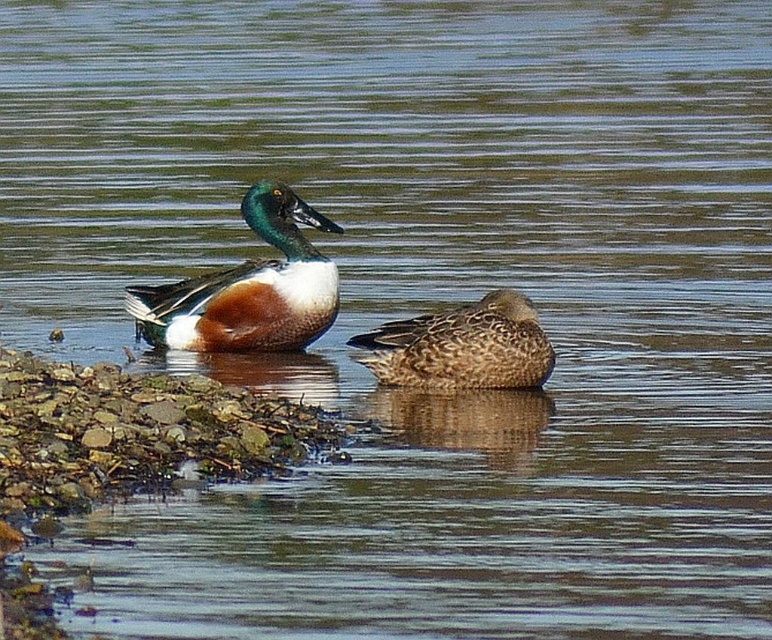
Can you confirm if shiny green duck at center is positioned above brown speckled duck at center?

Indeed, shiny green duck at center is positioned over brown speckled duck at center.

The image size is (772, 640). What do you see at coordinates (249, 289) in the screenshot? I see `shiny green duck at center` at bounding box center [249, 289].

Find the location of a particular element. The height and width of the screenshot is (640, 772). shiny green duck at center is located at coordinates (249, 289).